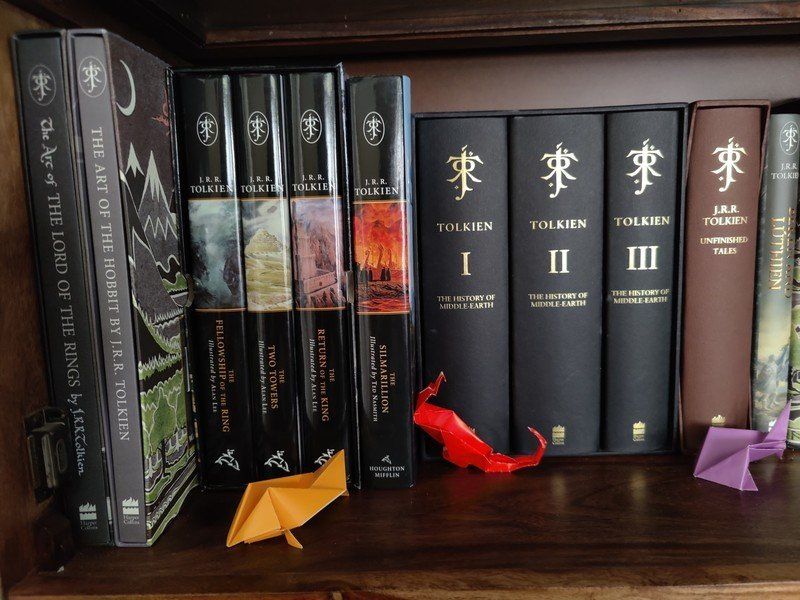
Locate an element on the screen. Image resolution: width=800 pixels, height=600 pixels. bottom of shelf is located at coordinates (593, 526), (417, 528), (745, 521), (162, 556).